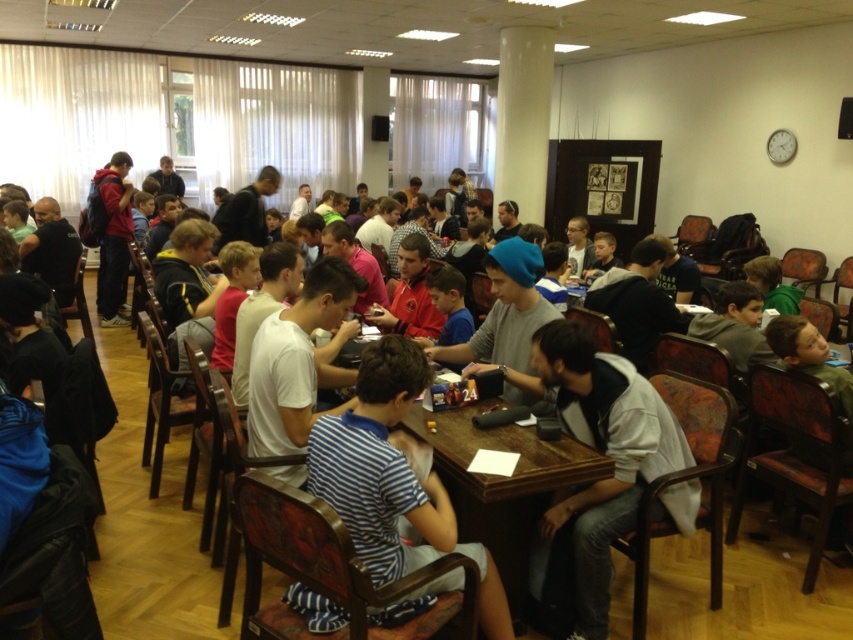
You are organizing a group activity in the room. You need to place a new item on the table. Which object, the white fleece jacket at center or the wooden table at center, is the larger one to determine where to place the item?

The wooden table at center is larger than the white fleece jacket at center, so place the item on the wooden table at center.